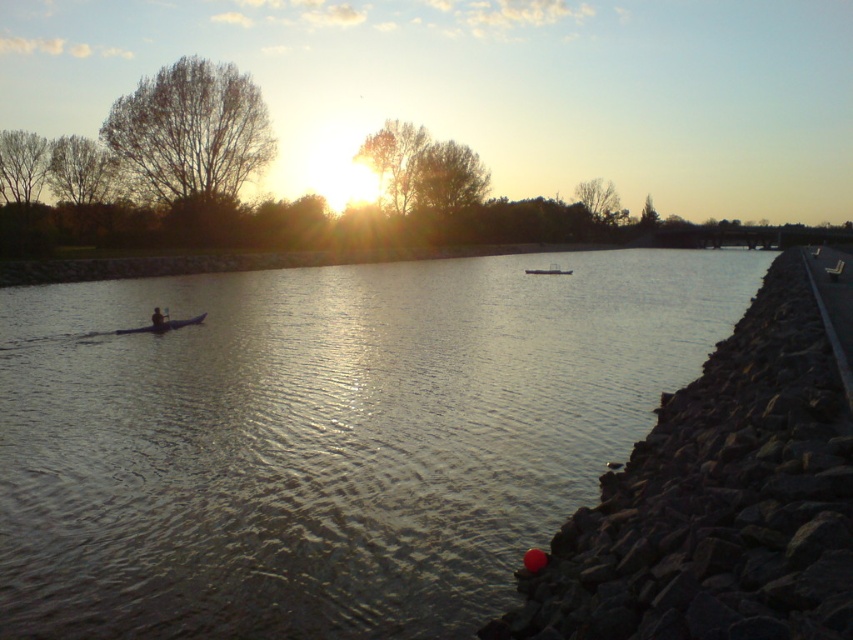
Is matte black kayak at left in front of metallic silver boat at center?

Yes, it is.

Can you confirm if matte black kayak at left is bigger than metallic silver boat at center?

No, matte black kayak at left is not bigger than metallic silver boat at center.

Who is more distant from viewer, (170, 321) or (543, 273)?

Point (543, 273)

Identify the location of matte black kayak at left. (161, 324).

Does silvery reflective water at center appear on the right side of matte black kayak at left?

Indeed, silvery reflective water at center is positioned on the right side of matte black kayak at left.

Is silvery reflective water at center smaller than matte black kayak at left?

No.

Is point (316, 378) behind point (155, 320)?

That is False.

At what (x,y) coordinates should I click in order to perform the action: click on silvery reflective water at center. Please return your answer as a coordinate pair (x, y). This screenshot has height=640, width=853. Looking at the image, I should click on point(328,436).

Is silvery reflective water at center bigger than smooth skin person at left?

Yes, silvery reflective water at center is bigger than smooth skin person at left.

Is point (476, 458) less distant than point (161, 323)?

Yes, point (476, 458) is in front of point (161, 323).

The image size is (853, 640). I want to click on silvery reflective water at center, so click(328, 436).